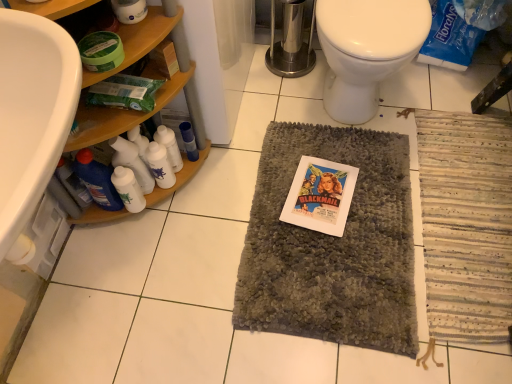
Where is `free space in front of blue plastic bottle at center, which is the 5th bottle from left to right`? The height and width of the screenshot is (384, 512). free space in front of blue plastic bottle at center, which is the 5th bottle from left to right is located at coordinates (198, 200).